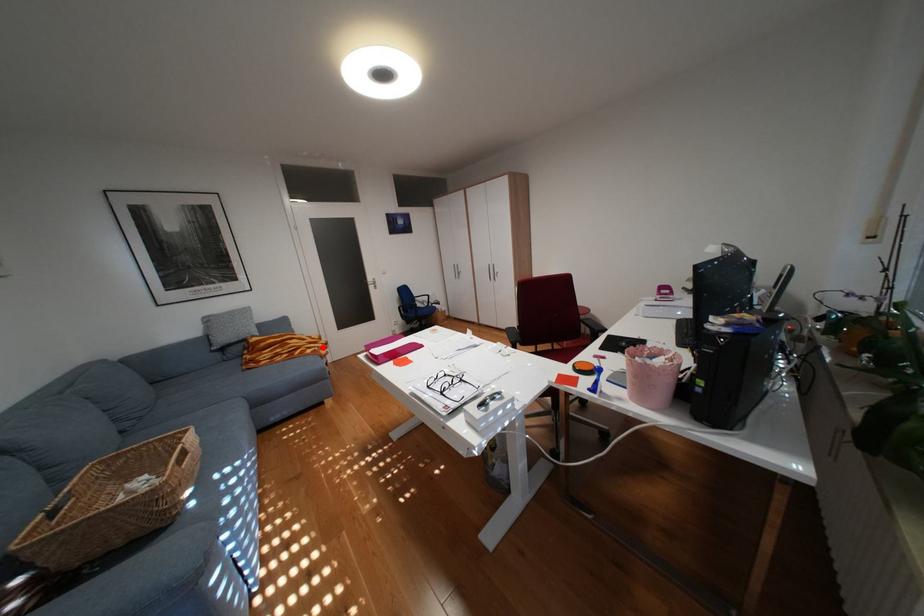
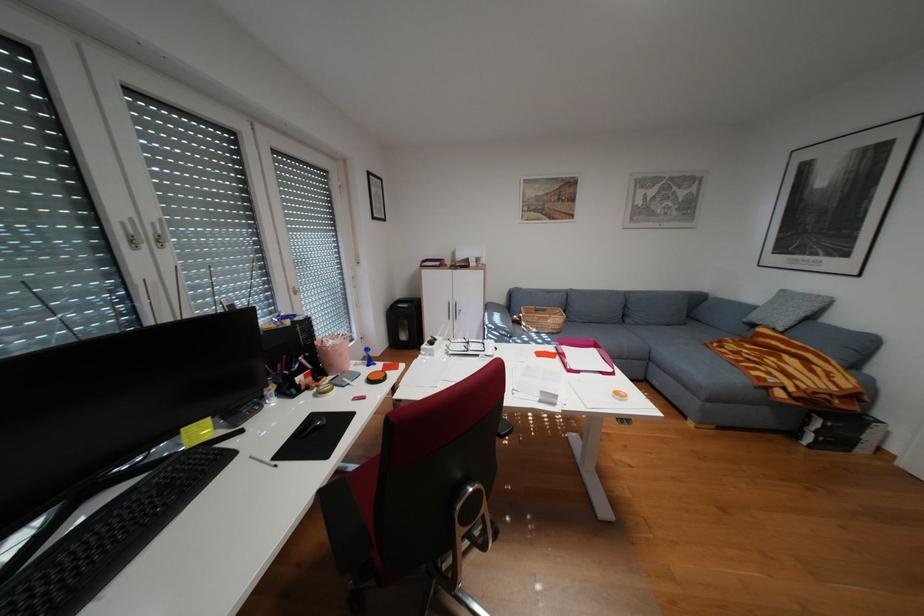
Question: I am providing you with two images of the same scene from different viewpoints. Image1 has a red point marked. In image2, the corresponding 3D location appears at what relative position? Reply with the corresponding letter.

Choices:
 (A) Closer
 (B) Farther

Answer: (B)